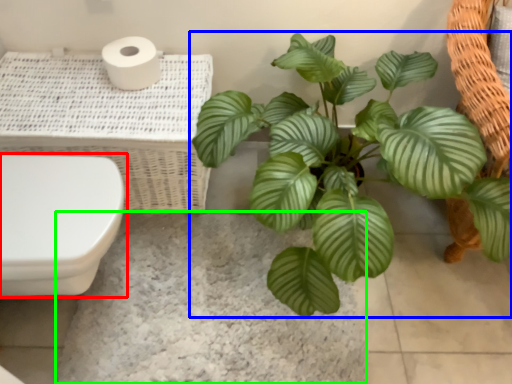
Question: Which is farther away from toilet (highlighted by a red box)? houseplant (highlighted by a blue box) or concrete (highlighted by a green box)?

Choices:
 (A) houseplant
 (B) concrete

Answer: (A)